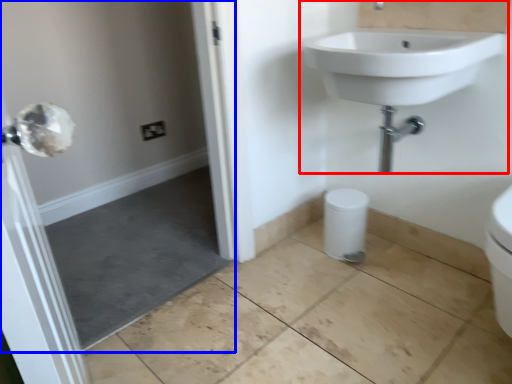
Question: Among these objects, which one is farthest to the camera, sink (highlighted by a red box) or screen door (highlighted by a blue box)?

Choices:
 (A) sink
 (B) screen door

Answer: (A)